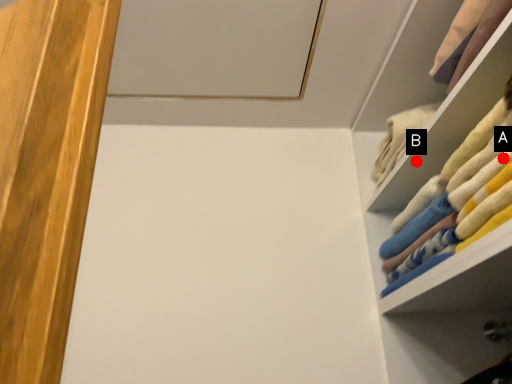
Question: Two points are circled on the image, labeled by A and B beside each circle. Which of the following is the farthest from the observer?

Choices:
 (A) A is further
 (B) B is further

Answer: (B)